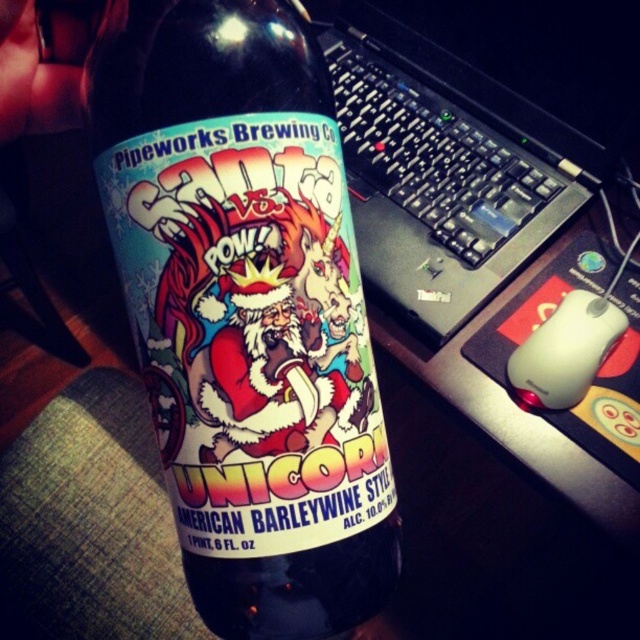
You are organizing a party and have both a glossy glass bottle at center and a black plastic keyboard at upper center on a small table. If you need to make space for more items, which object should you remove to free up more space?

The glossy glass bottle at center occupies less space than the black plastic keyboard at upper center, so removing the black plastic keyboard at upper center will free up more space.

What are the coordinates of the glossy glass bottle at center?

The glossy glass bottle at center is located at coordinates point [243,301].

? Alright, let me tackle this step by step. First, I need to understand the given information. The scene is a beer bottle label with specific elements, but the objects mentioned are a black plastic keyboard at upper center and a white matte mouse at lower right. The objects description says the keyboard is taller than the mouse. The task is to create a question and answer based on these without revealing the description details. The question must include both objects exactly as listed and use the scene as

? Wait, the user provided the scene description, but the objects and their description are about a keyboard and mouse, which seem unrelated to the beer bottle scene. That might be an error, but I have to work with what I have. Hmm, the scene is about a beer label, but the objects are keyboard and mouse. Maybe it was a mistake, but I should proceed as instructed. The question must mention both objects from the Objects list. Since the scene is the beer label, perhaps the keyboard and mouse are part of the